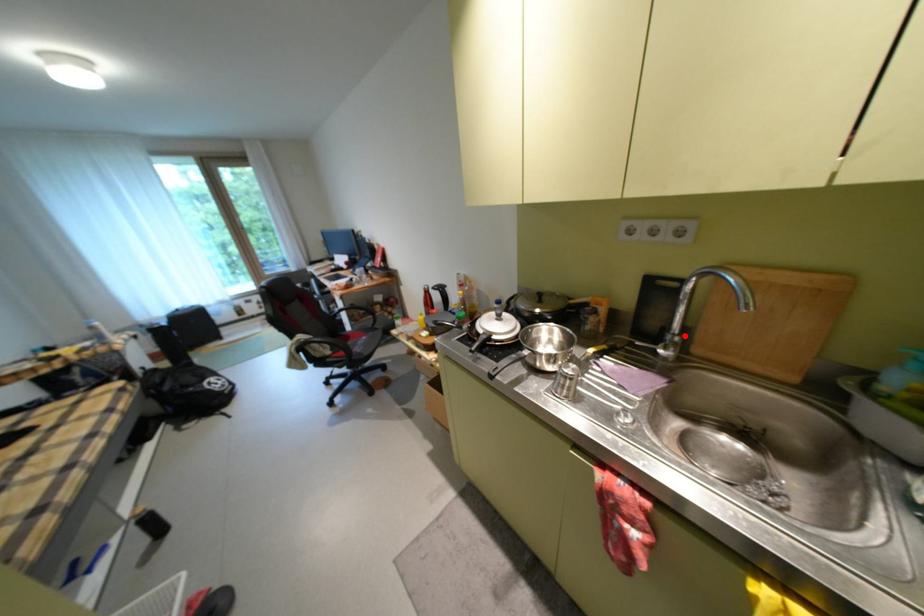
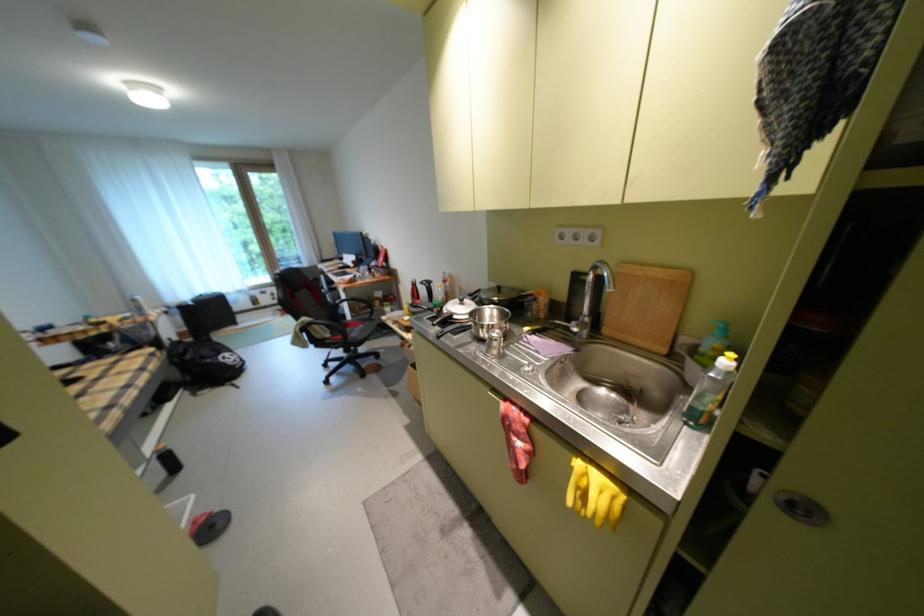
In the second image, find the point that corresponds to the highlighted location in the first image.

(596, 317)